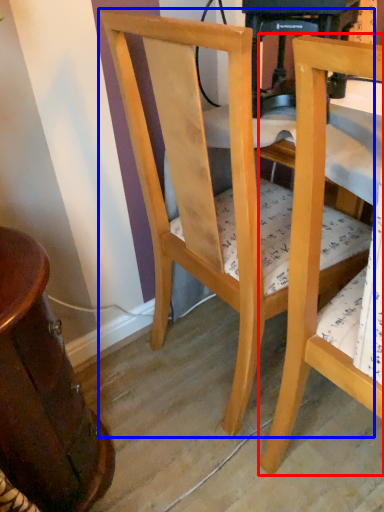
Question: Which object is further to the camera taking this photo, chair (highlighted by a red box) or chair (highlighted by a blue box)?

Choices:
 (A) chair
 (B) chair

Answer: (B)